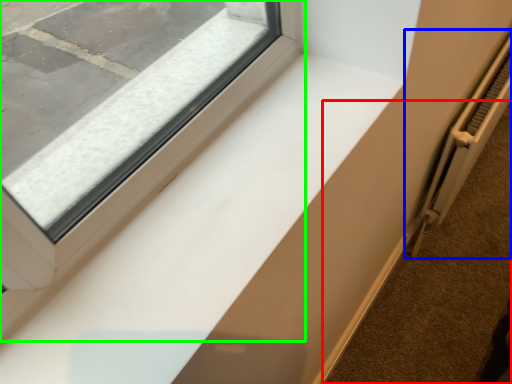
Question: Which is nearer to the pavement (highlighted by a red box)? radiator (highlighted by a blue box) or window (highlighted by a green box).

Choices:
 (A) radiator
 (B) window

Answer: (A)